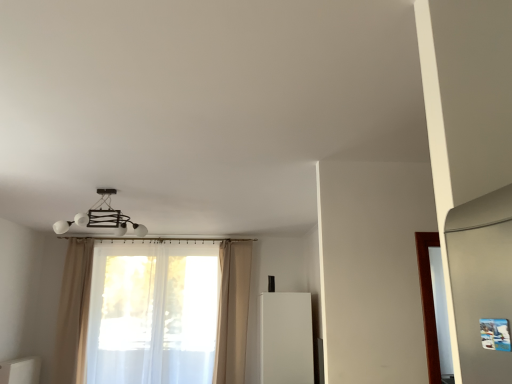
Question: Does white glossy cabinet at lower left have a lesser width compared to beige fabric curtain at left, which is the third curtain in right-to-left order?

Choices:
 (A) no
 (B) yes

Answer: (A)

Question: Is white glossy cabinet at lower left in contact with beige fabric curtain at left, which is the third curtain in right-to-left order?

Choices:
 (A) yes
 (B) no

Answer: (B)

Question: Is white glossy cabinet at lower left further to the viewer compared to beige fabric curtain at left, the 1th curtain in the left-to-right sequence?

Choices:
 (A) no
 (B) yes

Answer: (A)

Question: Is white glossy cabinet at lower left located outside beige fabric curtain at left, which is the third curtain in right-to-left order?

Choices:
 (A) no
 (B) yes

Answer: (B)

Question: Is white glossy cabinet at lower left not near beige fabric curtain at left, the 1th curtain in the left-to-right sequence?

Choices:
 (A) yes
 (B) no

Answer: (B)

Question: Is white glossy cabinet at lower left surrounding beige fabric curtain at left, which is the third curtain in right-to-left order?

Choices:
 (A) no
 (B) yes

Answer: (A)

Question: Is beige fabric curtain at center, acting as the third curtain starting from the left, oriented towards matte white chandelier at upper center?

Choices:
 (A) yes
 (B) no

Answer: (B)

Question: Is beige fabric curtain at center, acting as the third curtain starting from the left, facing away from matte white chandelier at upper center?

Choices:
 (A) no
 (B) yes

Answer: (A)

Question: Is beige fabric curtain at center, acting as the third curtain starting from the left, to the left of matte white chandelier at upper center from the viewer's perspective?

Choices:
 (A) yes
 (B) no

Answer: (B)

Question: From a real-world perspective, is beige fabric curtain at center, which is the first curtain from right to left, physically above matte white chandelier at upper center?

Choices:
 (A) no
 (B) yes

Answer: (A)

Question: Does beige fabric curtain at center, which is the first curtain from right to left, lie behind matte white chandelier at upper center?

Choices:
 (A) yes
 (B) no

Answer: (A)

Question: Is beige fabric curtain at center, which is the first curtain from right to left, bigger than matte white chandelier at upper center?

Choices:
 (A) yes
 (B) no

Answer: (A)

Question: Is translucent white curtain at center, acting as the second curtain starting from the left, a part of beige fabric curtain at left, the 1th curtain in the left-to-right sequence?

Choices:
 (A) yes
 (B) no

Answer: (B)